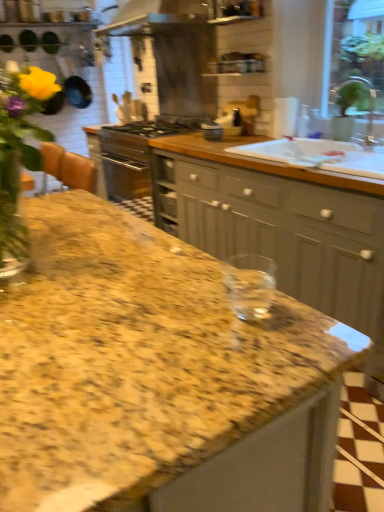
The image size is (384, 512). What do you see at coordinates (281, 226) in the screenshot? I see `matte gray cabinets at center` at bounding box center [281, 226].

What are the coordinates of `transparent glass jar at center` in the screenshot? It's located at (250, 284).

Locate an element on the screen. This screenshot has width=384, height=512. matte black toaster at center, the 2th appliance viewed from the front is located at coordinates (230, 123).

In the scene shown: Considering the relative positions of satin silver exhaust hood at upper center and matte black toaster at center, marked as the 1th appliance in a back-to-front arrangement, in the image provided, is satin silver exhaust hood at upper center behind matte black toaster at center, marked as the 1th appliance in a back-to-front arrangement,?

No, it is in front of matte black toaster at center, marked as the 1th appliance in a back-to-front arrangement.

Can you confirm if satin silver exhaust hood at upper center is bigger than matte black toaster at center, marked as the 1th appliance in a back-to-front arrangement?

Correct, satin silver exhaust hood at upper center is larger in size than matte black toaster at center, marked as the 1th appliance in a back-to-front arrangement.

Which object is thinner, satin silver exhaust hood at upper center or matte black toaster at center, marked as the 1th appliance in a back-to-front arrangement?

With smaller width is matte black toaster at center, marked as the 1th appliance in a back-to-front arrangement.

How different are the orientations of satin silver exhaust hood at upper center and matte black toaster at center, marked as the 1th appliance in a back-to-front arrangement, in degrees?

There is a 0.0149-degree angle between the facing directions of satin silver exhaust hood at upper center and matte black toaster at center, marked as the 1th appliance in a back-to-front arrangement.

Between transparent glass jar at center and granite at center, which one has larger width?

Wider between the two is granite at center.

In the scene shown: Considering the relative sizes of transparent glass jar at center and granite at center in the image provided, is transparent glass jar at center shorter than granite at center?

Incorrect, the height of transparent glass jar at center does not fall short of that of granite at center.

Looking at this image, from a real-world perspective, is transparent glass jar at center physically located above or below granite at center?

In terms of real-world spatial position, transparent glass jar at center is above granite at center.

Is transparent glass jar at center not within granite at center?

Yes.

Which object is positioned more to the left, transparent glass jar at center or matte gray cabinets at center?

Positioned to the left is transparent glass jar at center.

Is matte gray cabinets at center located within transparent glass jar at center?

No, matte gray cabinets at center is located outside of transparent glass jar at center.

Is transparent glass jar at center positioned with its back to matte gray cabinets at center?

transparent glass jar at center is not turned away from matte gray cabinets at center.

From the image's perspective, between matte gray cabinets at center and silver metallic faucet at upper right, which one is located above?

silver metallic faucet at upper right, from the image's perspective.

From a real-world perspective, who is located lower, matte gray cabinets at center or silver metallic faucet at upper right?

In real-world perspective, matte gray cabinets at center is lower.

In the image, is matte gray cabinets at center positioned in front of or behind silver metallic faucet at upper right?

In the image, matte gray cabinets at center appears in front of silver metallic faucet at upper right.

Is point (284, 170) in front of point (340, 97)?

That is True.

Between matte black kettle at center, arranged as the 1th appliance when viewed from the front, and transparent glass jar at center, which one has smaller size?

Smaller between the two is transparent glass jar at center.

Are matte black kettle at center, arranged as the 1th appliance when viewed from the front, and transparent glass jar at center far apart?

No, there isn't a large distance between matte black kettle at center, arranged as the 1th appliance when viewed from the front, and transparent glass jar at center.

Is matte black kettle at center, which is the 2th appliance from back to front, oriented towards transparent glass jar at center?

No, matte black kettle at center, which is the 2th appliance from back to front, is not turned towards transparent glass jar at center.

In the scene shown: Is transparent glass jar at center surrounded by matte black kettle at center, which is the 2th appliance from back to front?

No, transparent glass jar at center is located outside of matte black kettle at center, which is the 2th appliance from back to front.

Does silver metallic faucet at upper right have a lesser height compared to satin silver exhaust hood at upper center?

No, silver metallic faucet at upper right is not shorter than satin silver exhaust hood at upper center.

From a real-world perspective, is silver metallic faucet at upper right over satin silver exhaust hood at upper center?

No.

Considering the relative sizes of silver metallic faucet at upper right and satin silver exhaust hood at upper center in the image provided, is silver metallic faucet at upper right wider than satin silver exhaust hood at upper center?

No, silver metallic faucet at upper right is not wider than satin silver exhaust hood at upper center.

Considering the positions of point (268, 158) and point (272, 272), is point (268, 158) closer or farther from the camera than point (272, 272)?

Clearly, point (268, 158) is closer to the camera than point (272, 272).

Where is `glass jar above the white ceramic sink at upper right (from a real-world perspective)`? glass jar above the white ceramic sink at upper right (from a real-world perspective) is located at coordinates (250, 284).

How different are the orientations of white ceramic sink at upper right and transparent glass jar at center in degrees?

179 degrees separate the facing orientations of white ceramic sink at upper right and transparent glass jar at center.

Which is more to the right, white ceramic sink at upper right or transparent glass jar at center?

Positioned to the right is white ceramic sink at upper right.

Identify the location of exhaust hood in front of the matte black toaster at center, marked as the 1th appliance in a back-to-front arrangement. (154, 16).

Where is `countertop that is under the transparent glass jar at center (from a real-world perspective)`? The height and width of the screenshot is (512, 384). countertop that is under the transparent glass jar at center (from a real-world perspective) is located at coordinates (157, 377).

Based on their spatial positions, is satin silver exhaust hood at upper center or matte black kettle at center, arranged as the 1th appliance when viewed from the front, further from matte gray cabinets at center?

satin silver exhaust hood at upper center lies further to matte gray cabinets at center than the other object.

Which object lies further to the anchor point matte gray cabinets at center, satin silver exhaust hood at upper center or silver metallic faucet at upper right?

satin silver exhaust hood at upper center is further to matte gray cabinets at center.

Looking at the image, which one is located closer to satin silver exhaust hood at upper center, matte black kettle at center, which is the 2th appliance from back to front, or matte gray cabinets at center?

matte black kettle at center, which is the 2th appliance from back to front, is closer to satin silver exhaust hood at upper center.

Estimate the real-world distances between objects in this image. Which object is further from matte gray cabinets at center, white ceramic sink at upper right or granite at center?

granite at center.

From the image, which object appears to be nearer to matte black kettle at center, arranged as the 1th appliance when viewed from the front, white ceramic sink at upper right or silver metallic faucet at upper right?

white ceramic sink at upper right is closer to matte black kettle at center, arranged as the 1th appliance when viewed from the front.

In the scene shown: Considering their positions, is satin silver exhaust hood at upper center positioned closer to matte black kettle at center, which is the 2th appliance from back to front, than white ceramic sink at upper right?

The object closer to matte black kettle at center, which is the 2th appliance from back to front, is white ceramic sink at upper right.

Which object lies nearer to the anchor point white ceramic sink at upper right, satin silver exhaust hood at upper center or matte black toaster at center, marked as the 1th appliance in a back-to-front arrangement?

Based on the image, matte black toaster at center, marked as the 1th appliance in a back-to-front arrangement, appears to be nearer to white ceramic sink at upper right.

Which object lies further to the anchor point granite at center, matte gray cabinets at center or matte black toaster at center, marked as the 1th appliance in a back-to-front arrangement?

matte black toaster at center, marked as the 1th appliance in a back-to-front arrangement, lies further to granite at center than the other object.

The height and width of the screenshot is (512, 384). Find the location of `faucet between granite at center and matte black kettle at center, arranged as the 1th appliance when viewed from the front, along the z-axis`. faucet between granite at center and matte black kettle at center, arranged as the 1th appliance when viewed from the front, along the z-axis is located at coordinates (354, 104).

Locate an element on the screen. countertop between transparent glass jar at center and matte black toaster at center, the 2th appliance viewed from the front, along the z-axis is located at coordinates (157, 377).

This screenshot has height=512, width=384. Identify the location of countertop between satin silver exhaust hood at upper center and transparent glass jar at center vertically. (157, 377).

The image size is (384, 512). In order to click on faucet between transparent glass jar at center and matte black toaster at center, marked as the 1th appliance in a back-to-front arrangement, along the z-axis in this screenshot , I will do `click(354, 104)`.